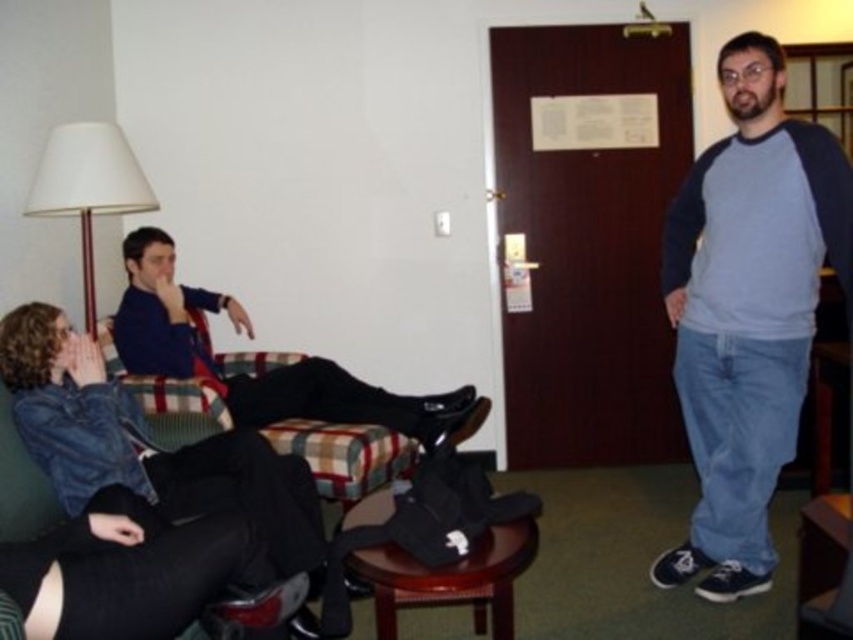
You are a hotel staff member and need to move a blue sweater at center and a brown wooden stool at lower center to make space for a new guest. Which object should you move first if you want to place the stool closer to the entrance?

The blue sweater at center is positioned on the left side of brown wooden stool at lower center. To move the stool closer to the entrance, you should first move the blue sweater at center out of the way so the stool can be shifted towards the entrance without obstruction.

You are standing in the hotel room and want to greet the person wearing the blue cotton shirt at right. To do so, should you walk around the plaid fabric couch at center to your left or right?

The blue cotton shirt at right is to the right of the plaid fabric couch at center. Therefore, to reach the blue cotton shirt at right, you should walk around the plaid fabric couch at center to your right.

You are a hotel staff member who needs to clean the room. You see the blue sweater at center and the brown wooden stool at lower center. Which object should you move first to access the area behind them?

The blue sweater at center is larger in size than the brown wooden stool at lower center, so you should move the blue sweater at center first to access the area behind them.